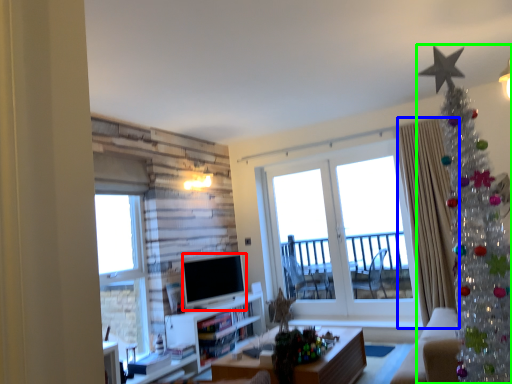
Question: Considering the real-world distances, which object is farthest from television (highlighted by a red box)? curtain (highlighted by a blue box) or christmas tree (highlighted by a green box)?

Choices:
 (A) curtain
 (B) christmas tree

Answer: (B)